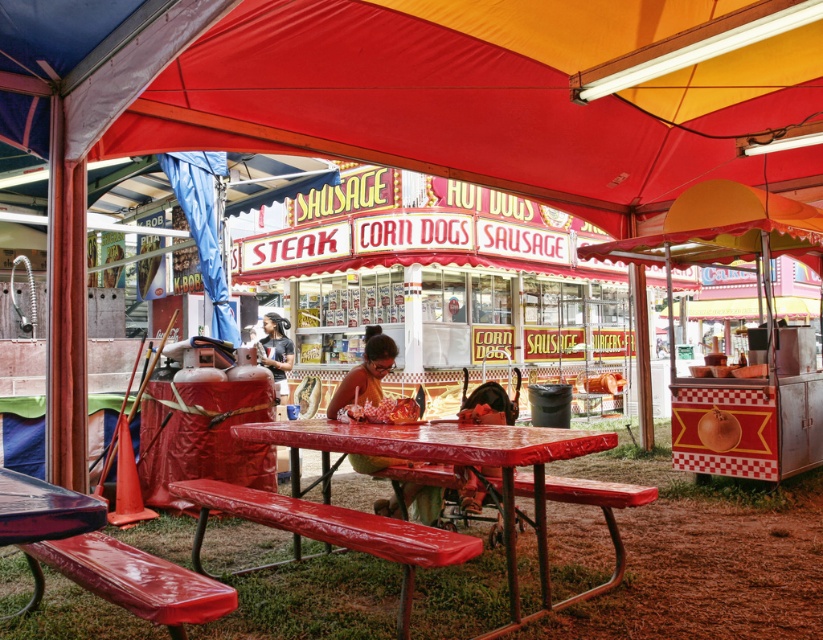
Question: Among these objects, which one is nearest to the camera?

Choices:
 (A) rubberized plastic bench at center
 (B) matte black shirt at center
 (C) metallic red picnic table at center

Answer: (C)

Question: Estimate the real-world distances between objects in this image. Which object is farther from the rubberized plastic bench at center?

Choices:
 (A) matte plastic food truck at center
 (B) metallic red picnic table at center
 (C) matte black shirt at center

Answer: (A)

Question: Is rubberized red bench at center further to camera compared to shiny red corn dog at center?

Choices:
 (A) no
 (B) yes

Answer: (A)

Question: Can you confirm if metallic red picnic table at center is smaller than matte plastic bag at center?

Choices:
 (A) no
 (B) yes

Answer: (A)

Question: Is metallic red picnic table at center below rubberized plastic bench at lower left?

Choices:
 (A) yes
 (B) no

Answer: (B)

Question: Considering the real-world distances, which object is closest to the matte plastic bag at center?

Choices:
 (A) rubberized red bench at center
 (B) matte black shirt at center
 (C) shiny red corn dog at center
 (D) shiny purple table at lower left

Answer: (C)